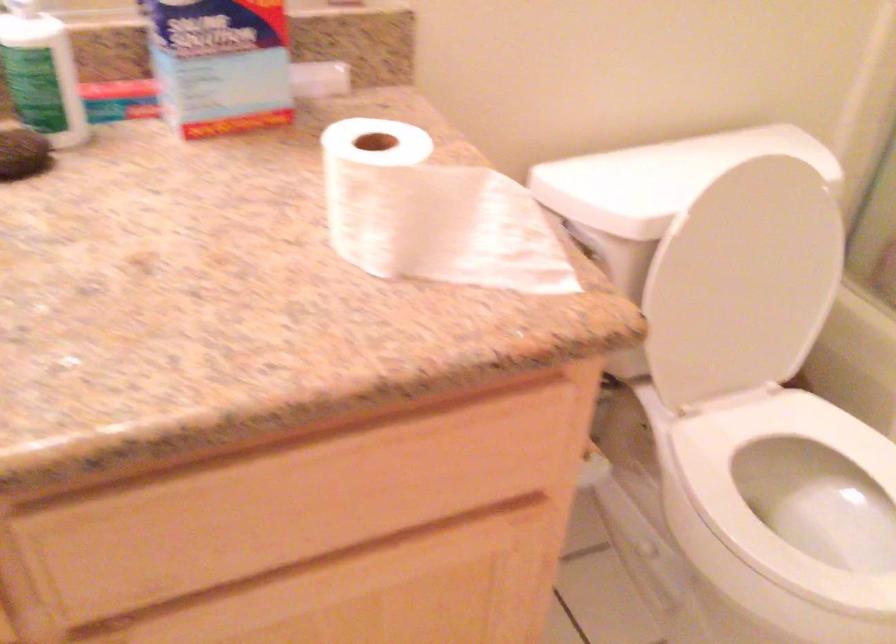
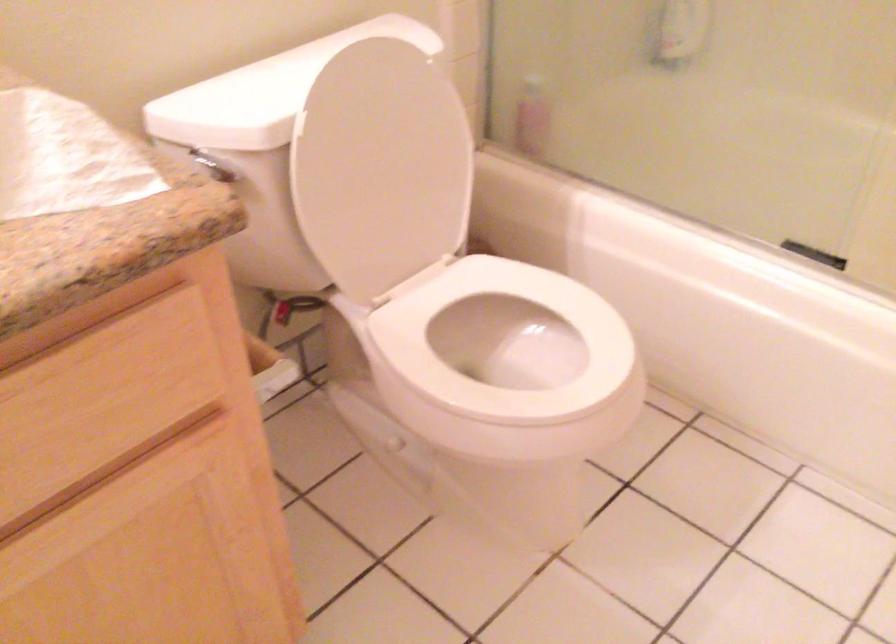
Where in the second image is the point corresponding to [494,384] from the first image?

(117, 303)